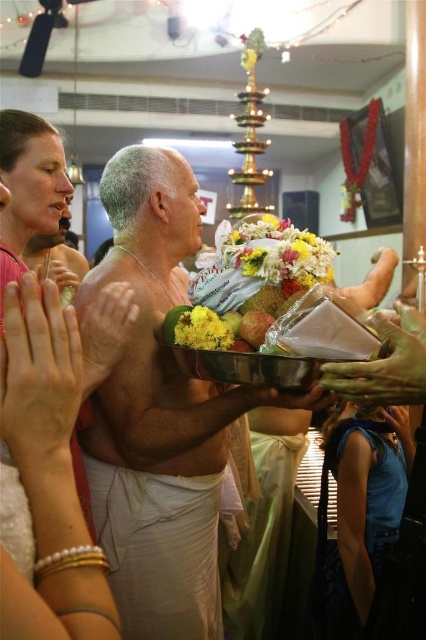
From the picture: In the temple scene, there is a white clothed man at center and a pink fabric at upper left. Which object is wider?

The white clothed man at center is wider than the pink fabric at upper left.

In the temple scene, there is a pink fabric at upper left and a blue fabric robe at lower right. Which one is shorter in length?

The pink fabric at upper left is shorter than the blue fabric robe at lower right.

Consider the image. You are a photographer standing at the back of the temple. You want to take a photo of the white clothed man at center and the pink fabric at upper left in the same frame. Given that your camera has a maximum focus range of 1.5 meters, will both subjects be in focus?

The white clothed man at center and pink fabric at upper left are 1.37 meters apart from each other, which is within the camera maximum focus range of 1.5 meters. Therefore, both subjects will be in focus.